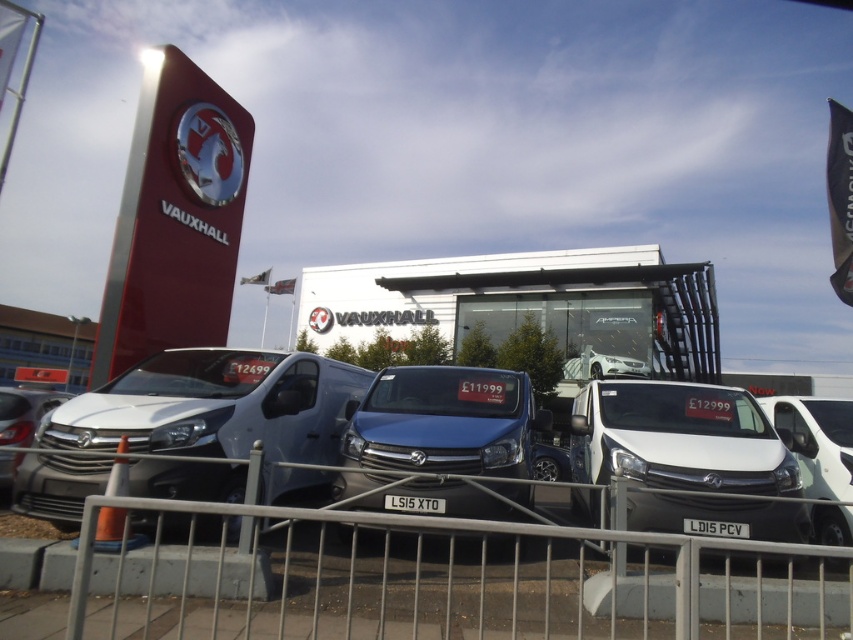
You are a customer looking to buy a van. You see the white glossy van at center and the matte silver van at center. Which van is shorter in height?

The white glossy van at center is not as tall as the matte silver van at center, so the white glossy van at center is shorter in height.

You are a delivery truck driver with a vehicle that is 7 meters long. You need to park your truck between the white glossy van at center and the matte silver van at center. Is there enough space between them to park your truck?

The distance between the white glossy van at center and the matte silver van at center is 6.70 meters. Since your truck is 7 meters long, there is not enough space to park it between them.

You are a customer looking at the vehicles displayed at the Vauxhall dealership. You see the white glossy van at center and the matte silver van at center. Which van is placed higher up in the display?

The white glossy van at center is positioned over the matte silver van at center, so it is placed higher up in the display.